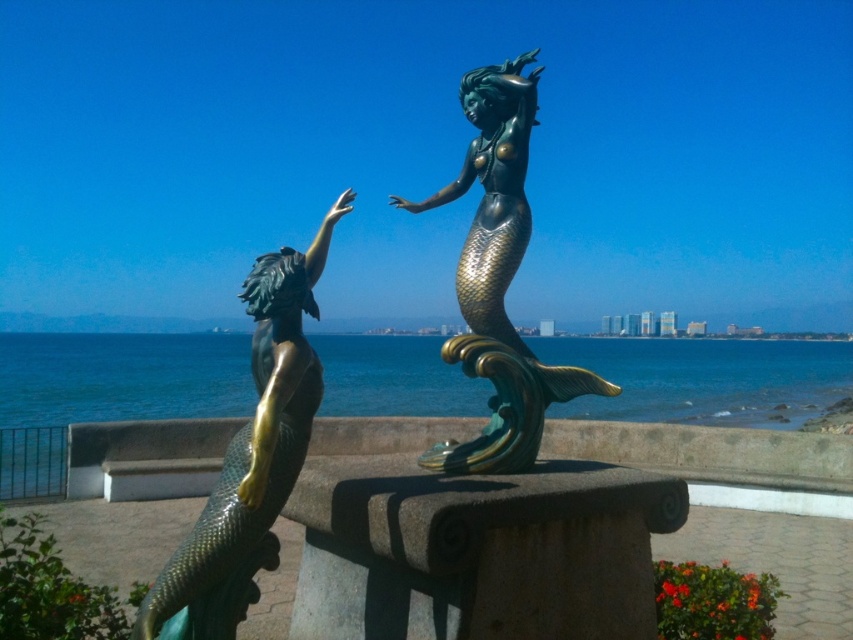
Can you confirm if blue-green water at center is positioned to the left of bronze mermaid at center?

No, blue-green water at center is not to the left of bronze mermaid at center.

Who is more distant from viewer, (669, 346) or (508, 65)?

Positioned behind is point (669, 346).

This screenshot has width=853, height=640. In order to click on blue-green water at center in this screenshot , I will do `click(706, 380)`.

Which is behind, point (248, 339) or point (216, 493)?

The point (248, 339) is behind.

Between blue-green water at center and green patina mermaid at center, which one appears on the right side from the viewer's perspective?

From the viewer's perspective, blue-green water at center appears more on the right side.

This screenshot has height=640, width=853. Identify the location of blue-green water at center. (706, 380).

This screenshot has width=853, height=640. Identify the location of blue-green water at center. (706, 380).

Is point (242, 285) positioned behind point (485, 100)?

No, it is in front of (485, 100).

Which is behind, point (294, 328) or point (448, 468)?

Positioned behind is point (448, 468).

Identify the location of green patina mermaid at center. This screenshot has width=853, height=640. (250, 458).